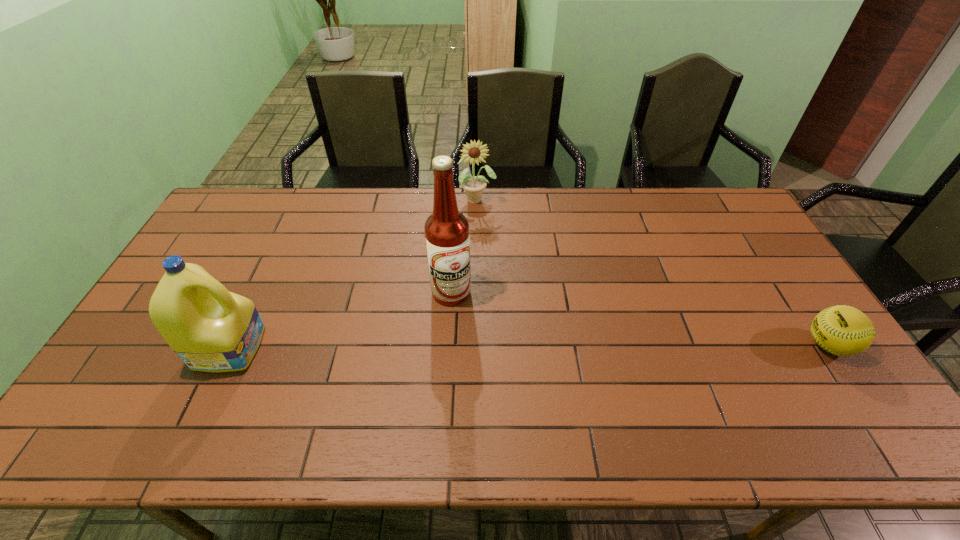
The image size is (960, 540). What are the coordinates of `the second tallest object` in the screenshot? It's located at (211, 329).

This screenshot has width=960, height=540. Identify the location of detergent. pos(211,329).

Find the location of a particular element. This screenshot has height=540, width=960. the rightmost object is located at coordinates (842, 330).

Identify the location of the shortest object. (842, 330).

Where is `the tallest object`? This screenshot has height=540, width=960. the tallest object is located at coordinates (447, 236).

You are a GUI agent. You are given a task and a screenshot of the screen. Output one action in this format:
    pyautogui.click(x=<x>, y=<y>)
    Task: Click on the third nearest object
    The height and width of the screenshot is (540, 960).
    Given the screenshot: What is the action you would take?
    point(447,236)

I want to click on the second shortest object, so click(474, 153).

You are a GUI agent. You are given a task and a screenshot of the screen. Output one action in this format:
    pyautogui.click(x=<x>, y=<y>)
    Task: Click on the sunflower
    The height and width of the screenshot is (540, 960).
    Given the screenshot: What is the action you would take?
    pyautogui.click(x=474, y=153)

The image size is (960, 540). Find the location of `vacant space located on the label of the leftmost object`. vacant space located on the label of the leftmost object is located at coordinates (358, 346).

At what (x,y) coordinates should I click in order to perform the action: click on free spot located 0.050m on the logo side of the rightmost object. Please return your answer as a coordinate pair (x, y). Looking at the image, I should click on (786, 345).